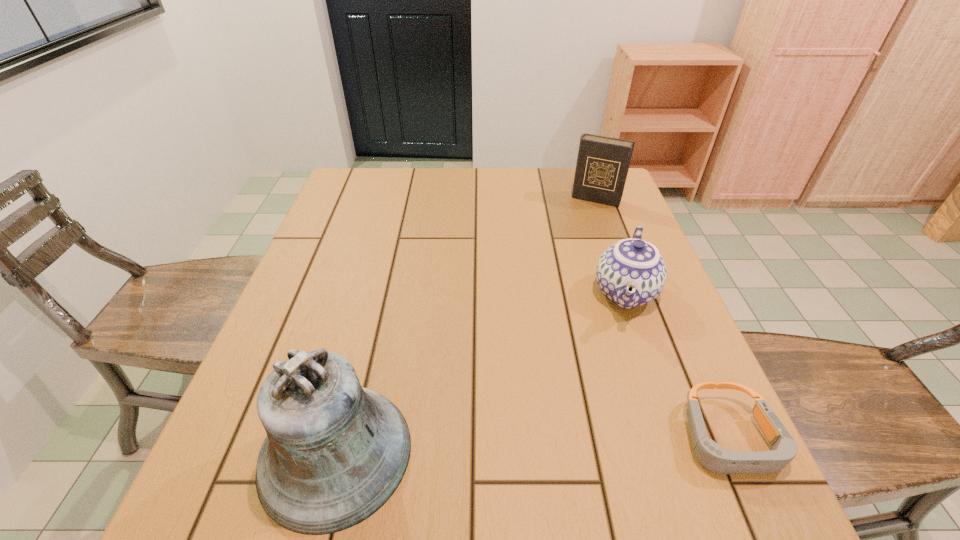
You are a GUI agent. You are given a task and a screenshot of the screen. Output one action in this format:
    pyautogui.click(x=<x>, y=<y>)
    Task: Click on the free location at the far right corner
    
    Given the screenshot: What is the action you would take?
    pyautogui.click(x=575, y=199)

Find the location of a particular element. Image resolution: width=960 pixels, height=540 pixels. vacant point located between the second farthest object and the diary is located at coordinates (611, 246).

Where is `unoccupied position between the leftmost object and the second tallest object`? This screenshot has height=540, width=960. unoccupied position between the leftmost object and the second tallest object is located at coordinates (466, 326).

Image resolution: width=960 pixels, height=540 pixels. In order to click on vacant space that's between the goggles and the third nearest object in this screenshot , I will do `click(677, 365)`.

This screenshot has height=540, width=960. I want to click on vacant space that's between the bell and the shortest object, so click(x=533, y=446).

Where is `vacant area that lies between the second farthest object and the shortest object`? The width and height of the screenshot is (960, 540). vacant area that lies between the second farthest object and the shortest object is located at coordinates coord(677,365).

Locate an element on the screen. This screenshot has height=540, width=960. unoccupied position between the third nearest object and the shortest object is located at coordinates click(x=677, y=365).

Where is `vacant space that's between the second tallest object and the third tallest object`? vacant space that's between the second tallest object and the third tallest object is located at coordinates (611, 246).

Locate an element on the screen. The height and width of the screenshot is (540, 960). free space between the chinaware and the shortest object is located at coordinates (677, 365).

The image size is (960, 540). Identify the location of vacant area that lies between the chinaware and the leftmost object. (480, 373).